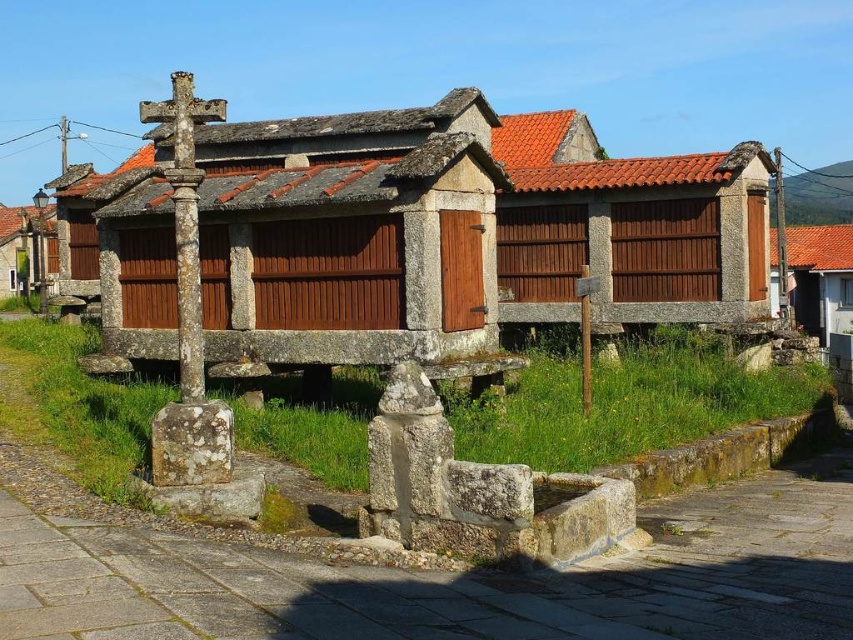
Question: Estimate the real-world distances between objects in this image. Which object is farther from the brown wooden hut at center?

Choices:
 (A) brown wooden hut at right
 (B) brown wooden hut at left
 (C) rusty stone cross at left

Answer: (B)

Question: Is brown wooden hut at center wider than brown wooden hut at right?

Choices:
 (A) yes
 (B) no

Answer: (B)

Question: Among these points, which one is farthest from the camera?

Choices:
 (A) (9, 289)
 (B) (831, 260)
 (C) (325, 125)

Answer: (B)

Question: Does brown wooden hut at center appear on the right side of rusty stone cross at left?

Choices:
 (A) yes
 (B) no

Answer: (A)

Question: Does rusty stone cross at left have a larger size compared to brown wooden hut at left?

Choices:
 (A) yes
 (B) no

Answer: (B)

Question: Which point is closer to the camera?

Choices:
 (A) brown wooden hut at right
 (B) brown wooden hut at center
 (C) rusty stone cross at left

Answer: (B)